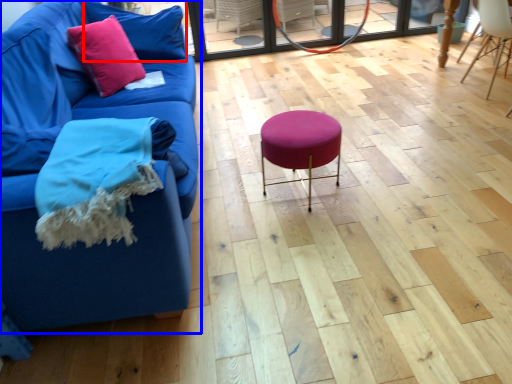
Question: Which object appears closest to the camera in this image, pillow (highlighted by a red box) or studio couch (highlighted by a blue box)?

Choices:
 (A) pillow
 (B) studio couch

Answer: (B)